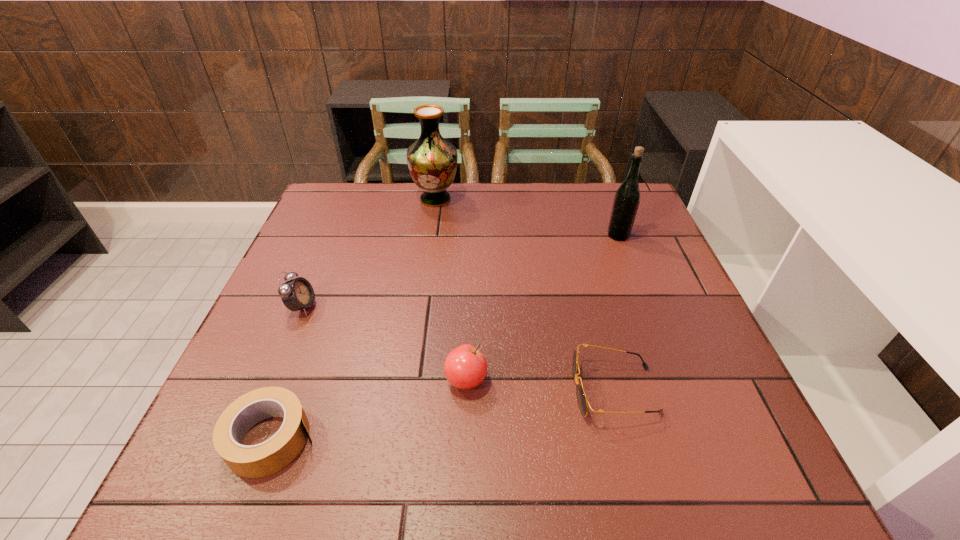
The width and height of the screenshot is (960, 540). I want to click on the farthest object, so click(x=432, y=161).

Identify the location of the rightmost object. The width and height of the screenshot is (960, 540). (627, 198).

I want to click on beer bottle, so click(x=627, y=198).

This screenshot has height=540, width=960. Find the location of `alarm clock`. alarm clock is located at coordinates (296, 294).

This screenshot has height=540, width=960. In order to click on the third tallest object in this screenshot , I will do `click(296, 294)`.

The width and height of the screenshot is (960, 540). In order to click on the fourth tallest object in this screenshot , I will do `click(465, 367)`.

This screenshot has width=960, height=540. Find the location of `duct tape`. duct tape is located at coordinates (251, 461).

I want to click on sunglasses, so click(x=582, y=400).

Where is `free location located 0.150m on the front of the farthest object`? This screenshot has width=960, height=540. free location located 0.150m on the front of the farthest object is located at coordinates (429, 243).

The height and width of the screenshot is (540, 960). I want to click on free space located 0.080m on the back of the beer bottle, so [610, 213].